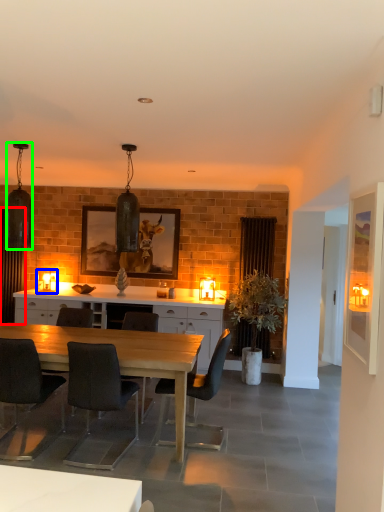
Question: Which object is the closest to the curtain (highlighted by a red box)? Choose among these: lamp (highlighted by a blue box) or lamp (highlighted by a green box).

Choices:
 (A) lamp
 (B) lamp

Answer: (A)